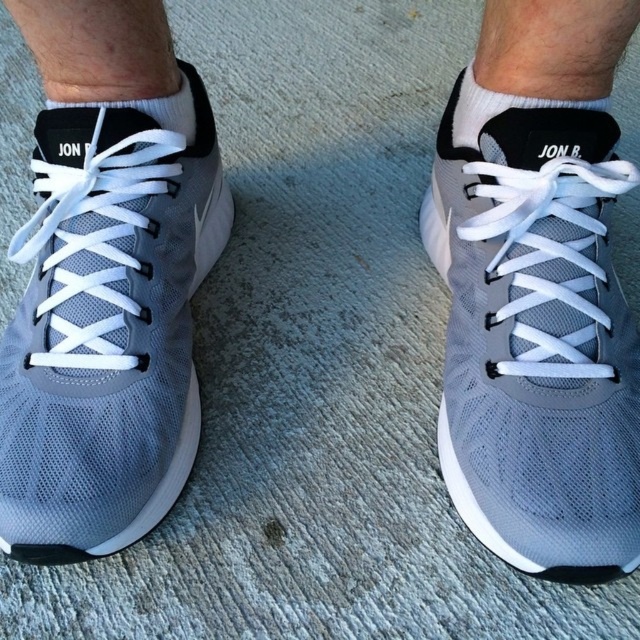
Question: Among these objects, which one is nearest to the camera?

Choices:
 (A) white cotton sock at upper center
 (B) matte gray shoe at center
 (C) matte gray sneaker at left
 (D) white cotton sock at center

Answer: (B)

Question: Among these objects, which one is farthest from the camera?

Choices:
 (A) white cotton sock at center
 (B) white cotton sock at upper center
 (C) matte gray shoe at center
 (D) matte gray sneaker at left

Answer: (A)

Question: Does matte gray sneaker at left appear under white cotton sock at upper center?

Choices:
 (A) yes
 (B) no

Answer: (A)

Question: Can you confirm if matte gray sneaker at left is positioned above white cotton sock at center?

Choices:
 (A) yes
 (B) no

Answer: (B)

Question: Which object is positioned closest to the white cotton sock at center?

Choices:
 (A) matte gray shoe at center
 (B) matte gray sneaker at left
 (C) white cotton sock at upper center

Answer: (B)

Question: Does matte gray shoe at center appear under matte gray sneaker at left?

Choices:
 (A) no
 (B) yes

Answer: (B)